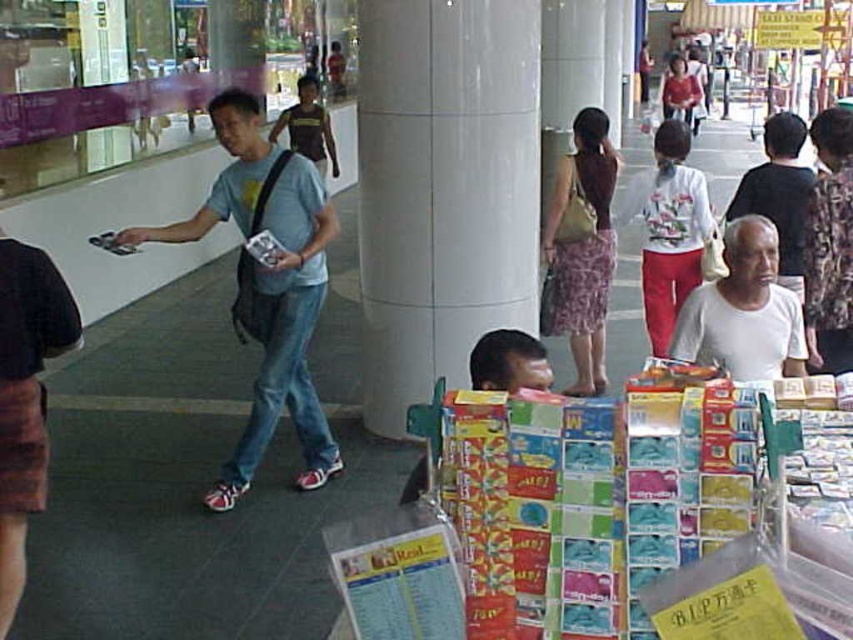
Question: Is light blue t-shirt at center to the left of brown textured shirt at center from the viewer's perspective?

Choices:
 (A) no
 (B) yes

Answer: (A)

Question: Does white glossy pillar at center have a larger size compared to purple floral skirt at center?

Choices:
 (A) yes
 (B) no

Answer: (A)

Question: Is brown textured shirt at center closer to camera compared to matte red shirt at center?

Choices:
 (A) no
 (B) yes

Answer: (B)

Question: Among these points, which one is nearest to the camera?

Choices:
 (A) (735, 225)
 (B) (683, 65)
 (C) (308, 164)

Answer: (A)

Question: Which object is positioned farthest from the matte red shirt at center?

Choices:
 (A) light blue t-shirt at center
 (B) white glossy pillar at center
 (C) white floral shirt at center
 (D) brown textured shirt at center

Answer: (A)

Question: Estimate the real-world distances between objects in this image. Which object is closer to the brown textured shirt at center?

Choices:
 (A) purple floral skirt at center
 (B) white glossy pillar at center
 (C) white matte shirt at center

Answer: (A)